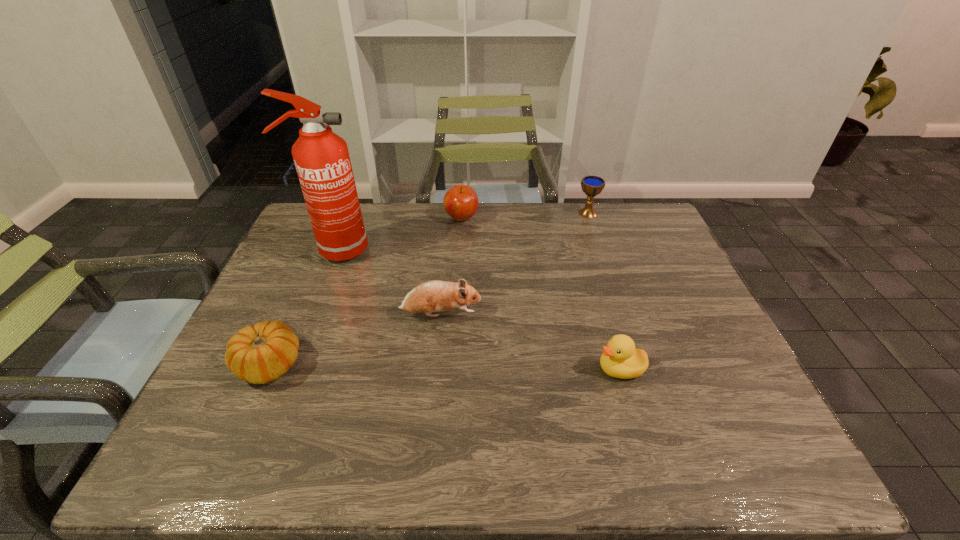
Image resolution: width=960 pixels, height=540 pixels. In order to click on the fourth nearest object in this screenshot , I will do `click(321, 157)`.

The width and height of the screenshot is (960, 540). I want to click on fire extinguisher, so click(x=321, y=157).

Locate an element on the screen. chalice is located at coordinates (591, 185).

Locate an element on the screen. apple is located at coordinates (461, 202).

Identify the location of hamster. Image resolution: width=960 pixels, height=540 pixels. (433, 296).

The height and width of the screenshot is (540, 960). Identify the location of duckling. (620, 359).

Locate an element on the screen. The image size is (960, 540). gourd is located at coordinates (259, 354).

Where is `vacant area situated 0.300m at the nozzle of the fire extinguisher`? This screenshot has width=960, height=540. vacant area situated 0.300m at the nozzle of the fire extinguisher is located at coordinates (468, 251).

At what (x,y) coordinates should I click in order to perform the action: click on vacant point located 0.340m on the front of the chalice. Please return your answer as a coordinate pair (x, y). Looking at the image, I should click on (612, 288).

I want to click on free point located on the front of the apple, so click(x=458, y=279).